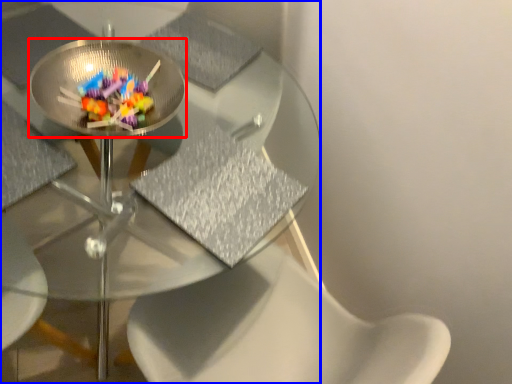
Question: Which object appears closest to the camera in this image, glass plate (highlighted by a red box) or table (highlighted by a blue box)?

Choices:
 (A) glass plate
 (B) table

Answer: (B)